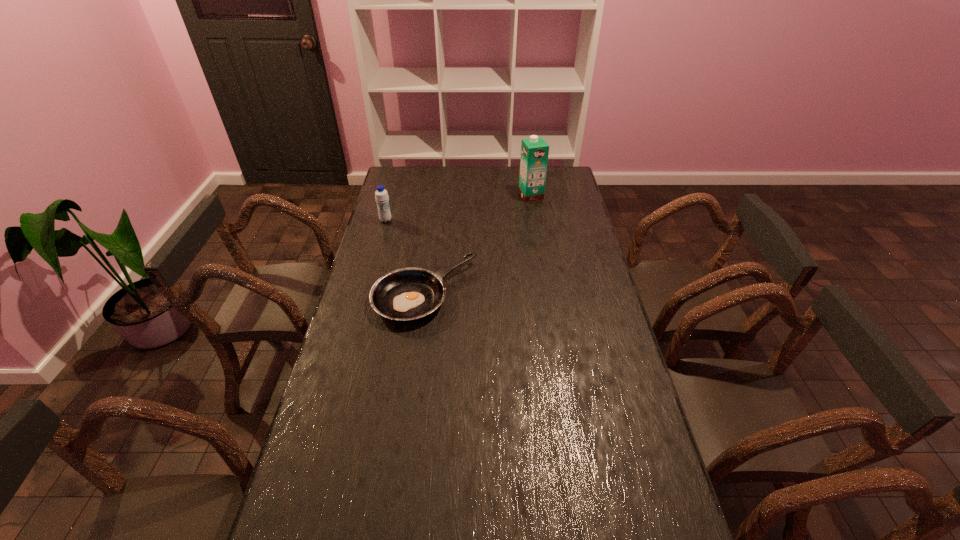
Locate an element on the screen. empty space that is in between the farthest object and the second tallest object is located at coordinates [x=458, y=208].

Find the location of a particular element. The height and width of the screenshot is (540, 960). vacant point located between the farthest object and the shortest object is located at coordinates (478, 244).

Where is `object that ranks as the second closest to the shortest object`? This screenshot has width=960, height=540. object that ranks as the second closest to the shortest object is located at coordinates (534, 151).

Find the location of a particular element. object that is the second closest to the second farthest object is located at coordinates (534, 151).

Locate an element on the screen. vacant area in the image that satisfies the following two spatial constraints: 1. on the back side of the tallest object; 2. on the right side of the water bottle is located at coordinates (393, 195).